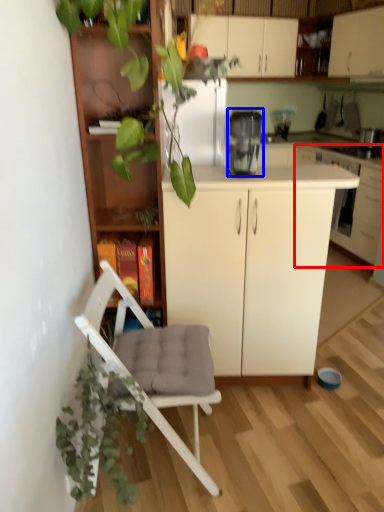
Question: Which object appears farthest to the camera in this image, cabinetry (highlighted by a red box) or appliance (highlighted by a blue box)?

Choices:
 (A) cabinetry
 (B) appliance

Answer: (A)